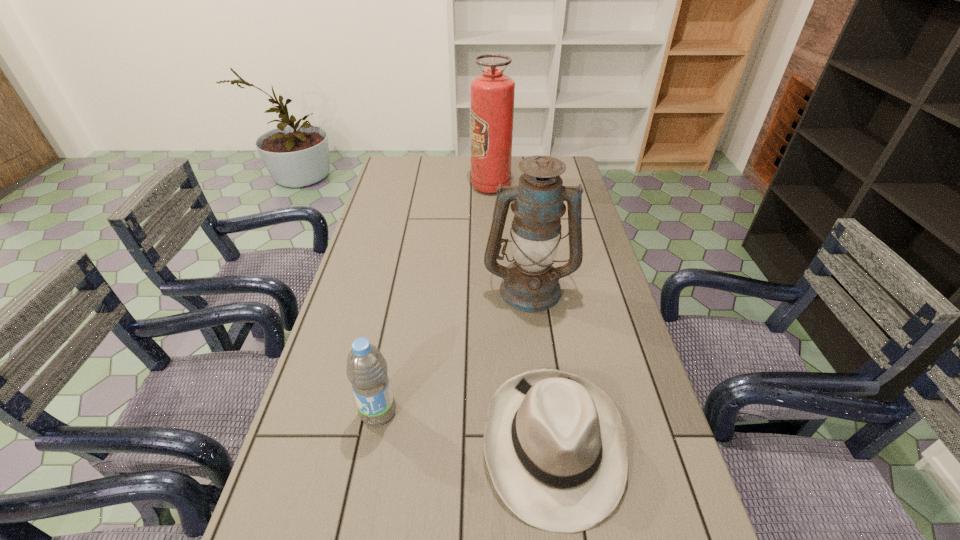
Where is `object at the far edge`? object at the far edge is located at coordinates (492, 93).

Identify the location of object positioned at the left edge. (367, 369).

This screenshot has height=540, width=960. Find the location of `oil lamp that is at the right edge`. oil lamp that is at the right edge is located at coordinates (531, 284).

At what (x,y) coordinates should I click in order to perform the action: click on fedora that is at the right edge. Please return your answer as a coordinate pair (x, y). Looking at the image, I should click on (555, 445).

This screenshot has width=960, height=540. I want to click on free space at the far edge of the desktop, so click(459, 172).

The width and height of the screenshot is (960, 540). Find the location of `vacant space at the left edge of the desktop`. vacant space at the left edge of the desktop is located at coordinates (409, 200).

What are the coordinates of `blank space at the right edge of the desktop` in the screenshot? It's located at (591, 338).

In the image, there is a desktop. At what (x,y) coordinates should I click in order to perform the action: click on vacant space at the far left corner. Please return your answer as a coordinate pair (x, y). The height and width of the screenshot is (540, 960). Looking at the image, I should click on (393, 177).

The height and width of the screenshot is (540, 960). I want to click on free spot between the fedora and the water bottle, so tap(466, 428).

At what (x,y) coordinates should I click in order to perform the action: click on vacant point located between the oil lamp and the water bottle. Please return your answer as a coordinate pair (x, y). Looking at the image, I should click on [x=454, y=350].